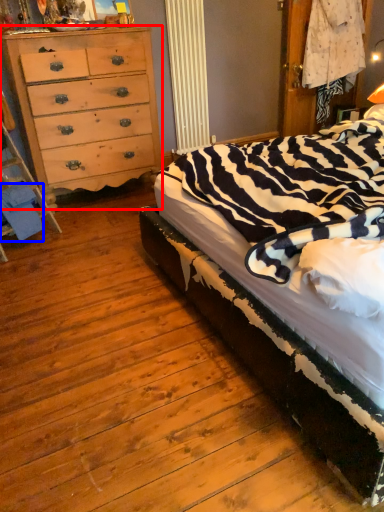
Question: Which object appears closest to the camera in this image, chest of drawers (highlighted by a red box) or material (highlighted by a blue box)?

Choices:
 (A) chest of drawers
 (B) material

Answer: (B)